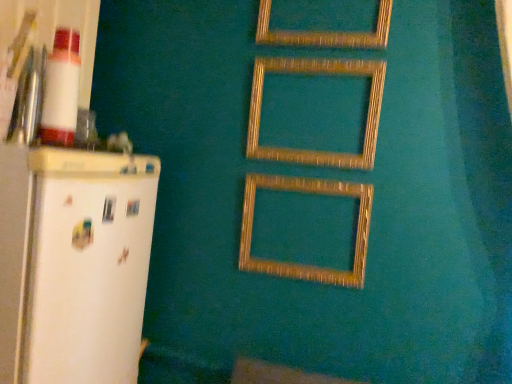
Question: Is wooden frame at center, which is counted as the second picture frame, starting from the bottom, wider or thinner than white matte refrigerator at left?

Choices:
 (A) wide
 (B) thin

Answer: (B)

Question: Looking at the image, does wooden frame at center, placed as the 2th picture frame when sorted from top to bottom, seem bigger or smaller compared to white matte refrigerator at left?

Choices:
 (A) small
 (B) big

Answer: (A)

Question: Considering the real-world distances, which object is closest to the gold textured picture frame at center, the first picture frame ordered from the bottom?

Choices:
 (A) gold textured frame at upper center, which is the 3th picture frame in bottom-to-top order
 (B) wooden frame at center, placed as the 2th picture frame when sorted from top to bottom
 (C) white matte refrigerator at left

Answer: (B)

Question: Which of these objects is positioned closest to the gold textured frame at upper center, which is the 3th picture frame in bottom-to-top order?

Choices:
 (A) white matte refrigerator at left
 (B) gold textured picture frame at center, the first picture frame ordered from the bottom
 (C) wooden frame at center, which is counted as the second picture frame, starting from the bottom

Answer: (C)